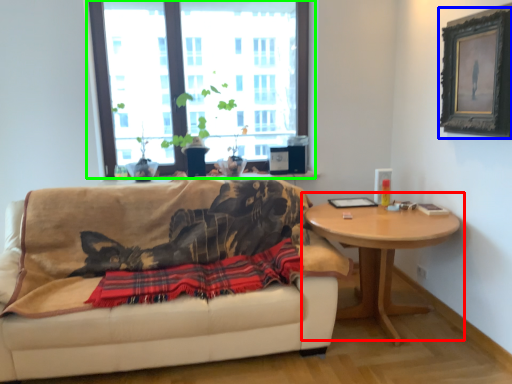
Question: Based on their relative distances, which object is farther from coffee table (highlighted by a red box)? Choose from picture frame (highlighted by a blue box) and window (highlighted by a green box).

Choices:
 (A) picture frame
 (B) window

Answer: (B)